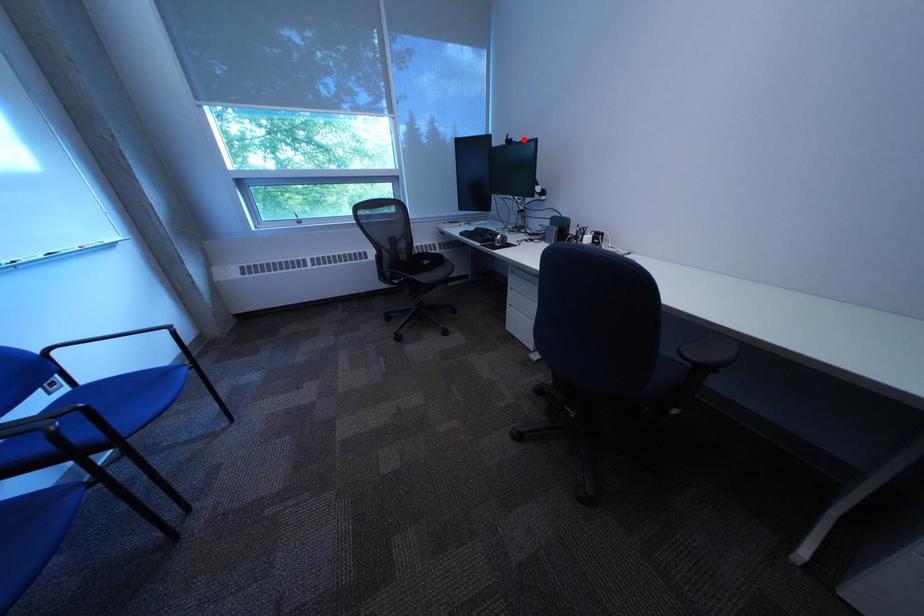
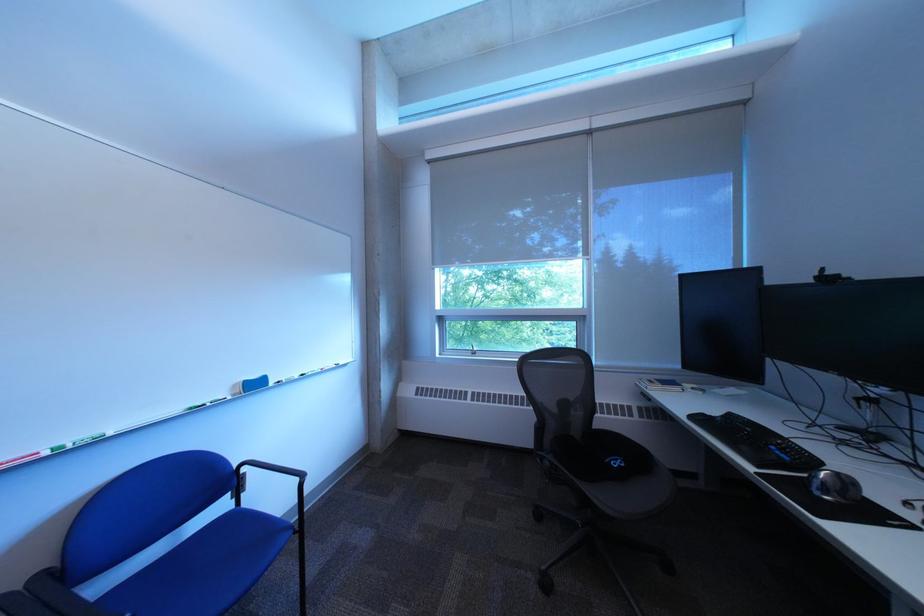
Where in the second image is the point corresponding to the highlighted location from the first image?

(843, 275)